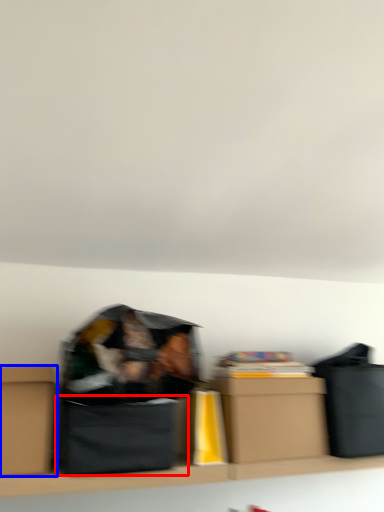
Question: Among these objects, which one is farthest to the camera, cardboard box (highlighted by a red box) or box (highlighted by a blue box)?

Choices:
 (A) cardboard box
 (B) box

Answer: (A)